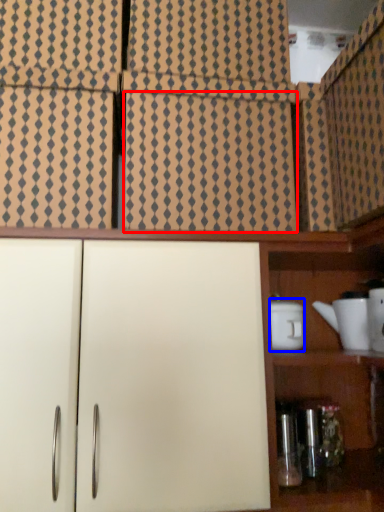
Question: Which of the following is the closest to the observer, tile (highlighted by a red box) or appliance (highlighted by a blue box)?

Choices:
 (A) tile
 (B) appliance

Answer: (A)